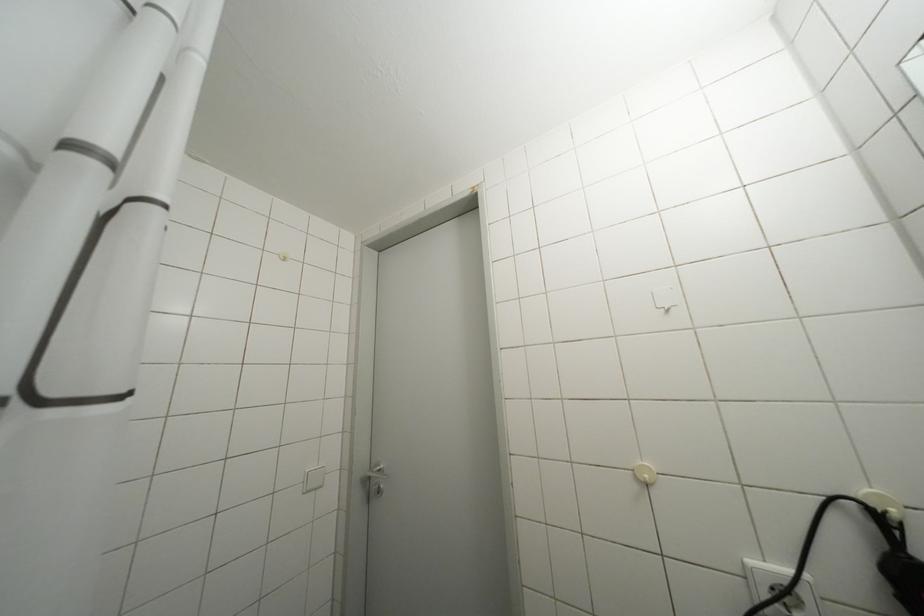
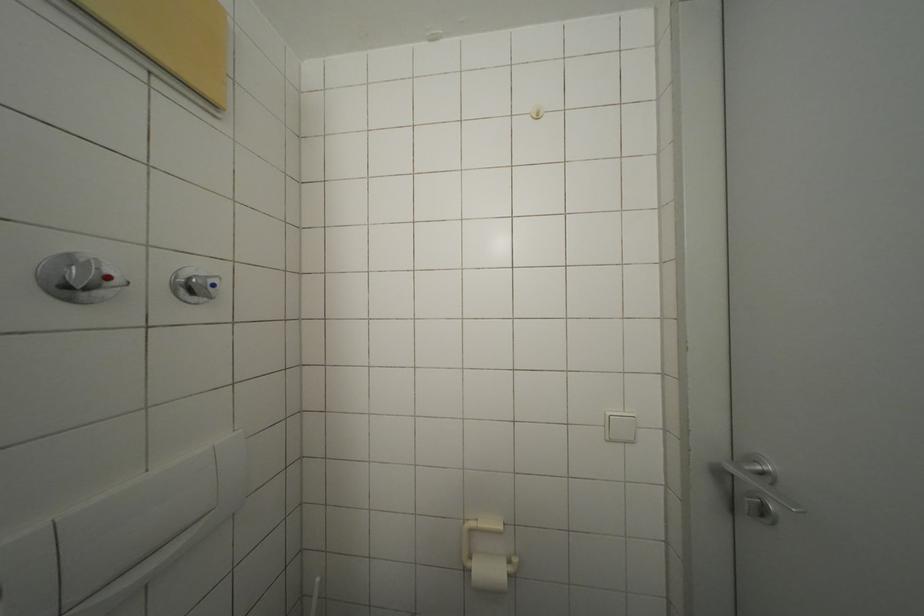
Question: The first image is from the beginning of the video and the second image is from the end. How did the camera likely rotate when shooting the video?

Choices:
 (A) Left
 (B) Right
 (C) Up
 (D) Down

Answer: (A)